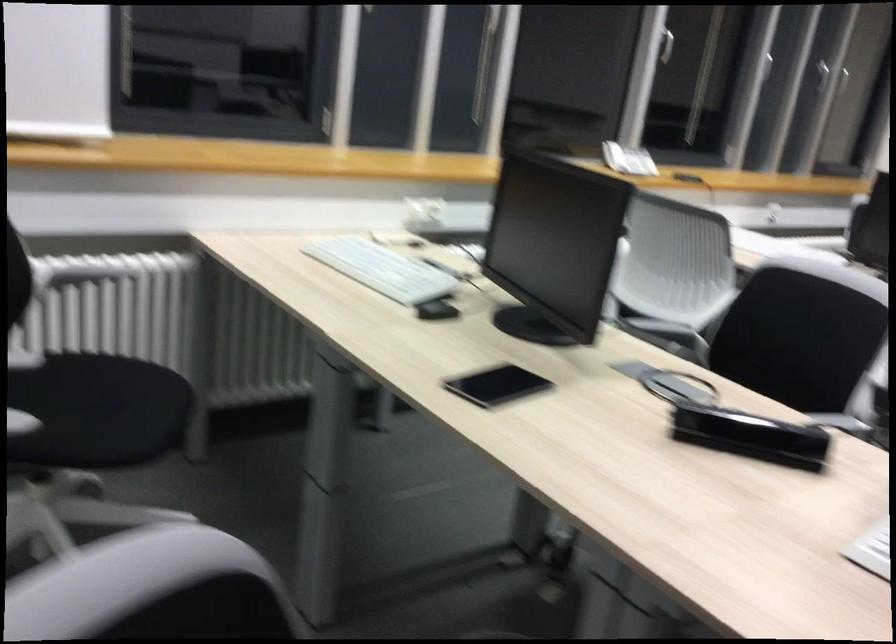
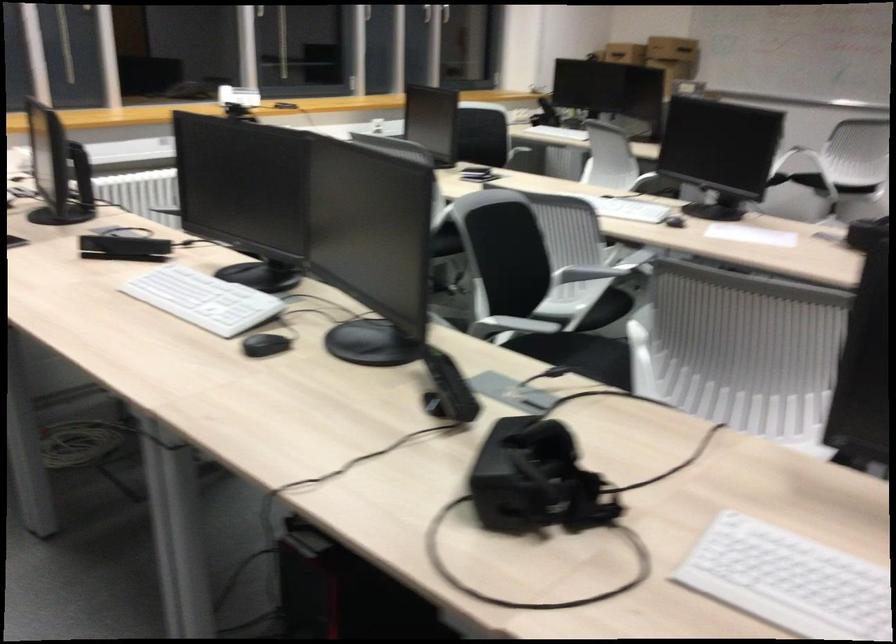
The point at (730, 415) is marked in the first image. Where is the corresponding point in the second image?

(124, 247)